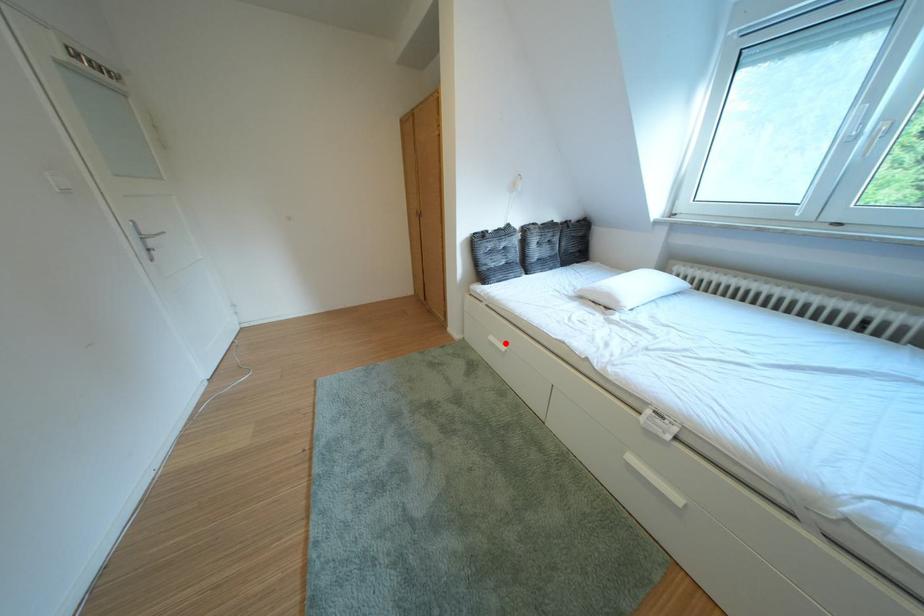
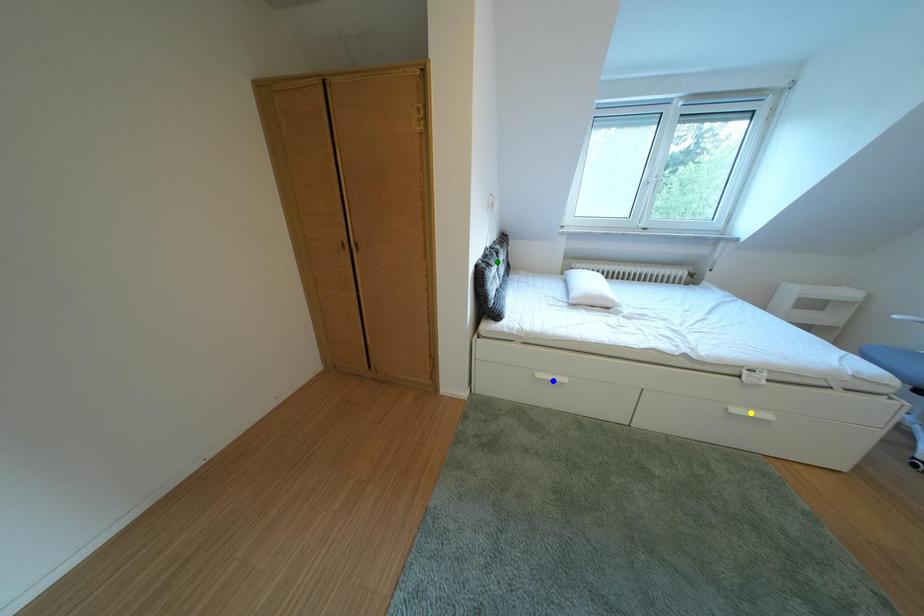
Question: I am providing you with two images of the same scene from different viewpoints. A red point is marked on the first image. You are given multiple points on the second image. Which point in image 2 is actually the same real-world point as the red point in image 1?

Choices:
 (A) yellow point
 (B) blue point
 (C) green point

Answer: (B)